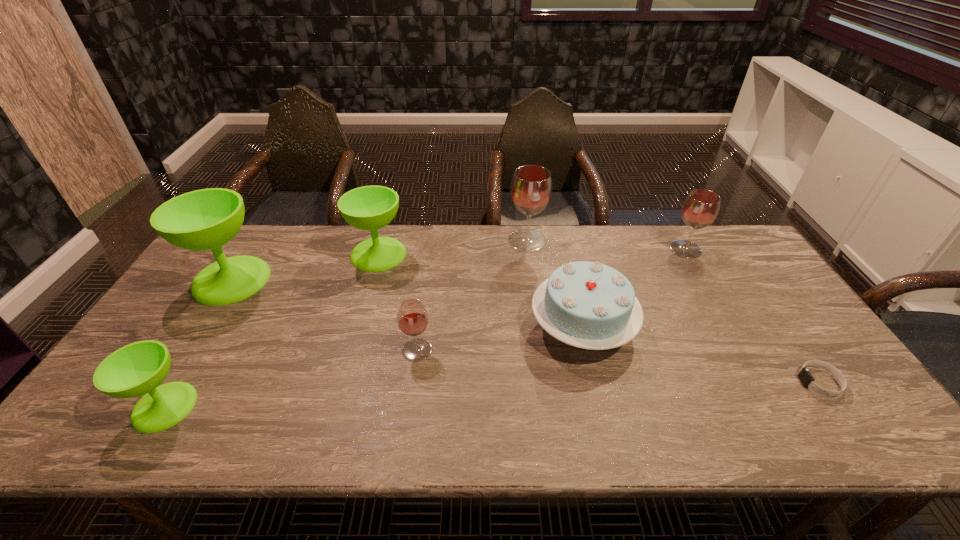
Image resolution: width=960 pixels, height=540 pixels. Identify the location of free region located on the right of the nearest green wineglass. (220, 407).

The width and height of the screenshot is (960, 540). I want to click on vacant space situated on the outer surface of the shortest object, so click(735, 382).

The height and width of the screenshot is (540, 960). I want to click on free region located on the outer surface of the shortest object, so click(653, 382).

In order to click on free location located 0.150m on the outer surface of the shortest object in this screenshot , I will do `click(739, 382)`.

Image resolution: width=960 pixels, height=540 pixels. I want to click on object that is at the near edge, so click(139, 368).

Where is `wineglass that is at the right edge`? The height and width of the screenshot is (540, 960). wineglass that is at the right edge is located at coordinates (x=701, y=207).

The width and height of the screenshot is (960, 540). Identify the location of wristband situated at the right edge. (806, 378).

Locate an element on the screen. The image size is (960, 540). object located at the far left corner is located at coordinates (206, 219).

Where is `object located in the near left corner section of the desktop`? Image resolution: width=960 pixels, height=540 pixels. object located in the near left corner section of the desktop is located at coordinates (139, 368).

Identify the location of object that is at the far right corner. This screenshot has height=540, width=960. (701, 207).